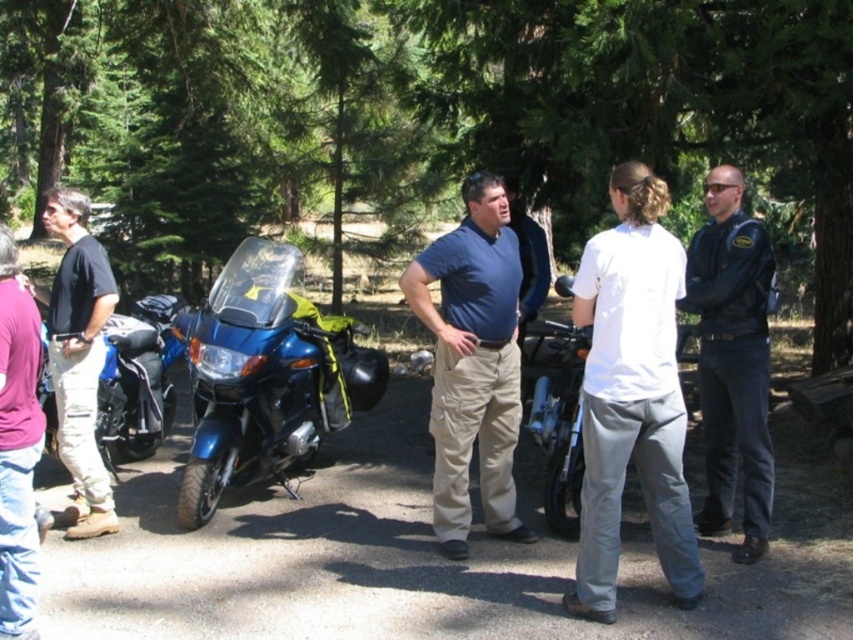
In the scene shown: Can you confirm if blue metallic motorcycle at center is wider than blue cotton shirt at center?

Yes.

Who is lower down, blue metallic motorcycle at center or blue cotton shirt at center?

blue metallic motorcycle at center is lower down.

Who is more forward, (312, 346) or (457, 269)?

Positioned in front is point (457, 269).

Identify the location of blue metallic motorcycle at center. (265, 376).

Which is behind, point (659, 545) or point (155, 449)?

Positioned behind is point (155, 449).

Is point (585, 440) positioned before point (138, 387)?

Yes, it is.

Locate an element on the screen. Image resolution: width=853 pixels, height=640 pixels. white cotton shirt at center is located at coordinates (631, 394).

Measure the distance between white cotton shirt at center and blue metallic motorcycle at center.

white cotton shirt at center and blue metallic motorcycle at center are 10.30 feet apart.

Is white cotton shirt at center to the left of blue metallic motorcycle at center from the viewer's perspective?

Incorrect, white cotton shirt at center is not on the left side of blue metallic motorcycle at center.

Which is in front, point (616, 536) or point (235, 324)?

Point (616, 536)

This screenshot has width=853, height=640. Identify the location of white cotton shirt at center. tap(631, 394).